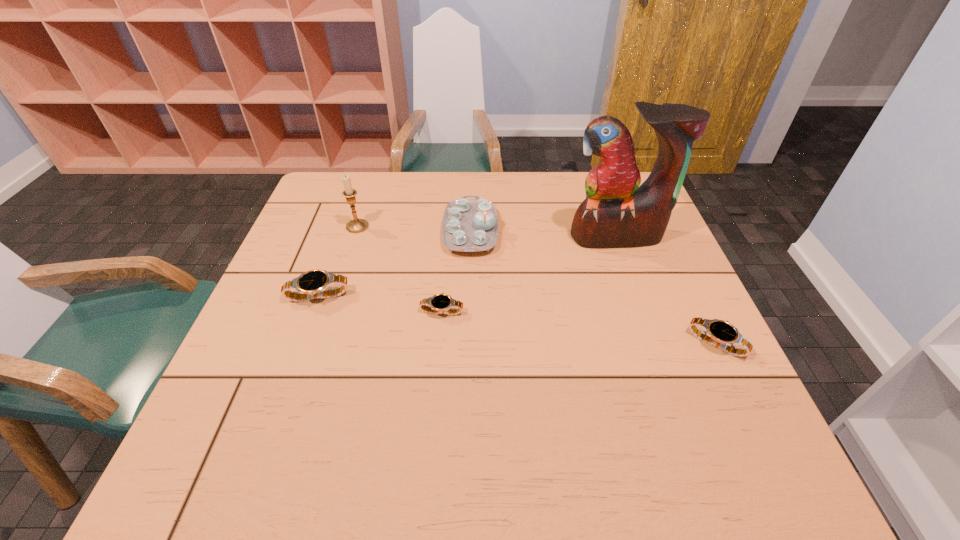
Locate an element on the screen. free spot between the second tallest object and the nearest object is located at coordinates (537, 285).

I want to click on unoccupied position between the rightmost watch and the shortest object, so click(x=579, y=327).

Identify the location of empty location between the fourth tallest object and the second watch from right to left. (380, 304).

Where is `free point between the second tallest object and the third tallest object`? The width and height of the screenshot is (960, 540). free point between the second tallest object and the third tallest object is located at coordinates (414, 228).

I want to click on free space between the shortest object and the candle holder, so click(x=399, y=269).

Select which object appears as the second closest to the fourth shortest object. Please provide its 2D coordinates. Your answer should be formatted as a tuple, i.e. [(x, y)], where the tuple contains the x and y coordinates of a point satisfying the conditions above.

[(617, 212)]

Find the location of a particular element. The width and height of the screenshot is (960, 540). the fourth closest object to the shortest watch is located at coordinates (617, 212).

Find the location of a particular element. The width and height of the screenshot is (960, 540). watch that is the second nearest to the tallest object is located at coordinates (439, 303).

This screenshot has height=540, width=960. Identify the location of watch that is the third closest to the tallest object. (311, 285).

At what (x,y) coordinates should I click in order to perform the action: click on free point that satisfies the following two spatial constraints: 1. on the back side of the candle holder; 2. on the right side of the leftmost watch. Please return your answer as a coordinate pair (x, y). The image size is (960, 540). Looking at the image, I should click on (344, 226).